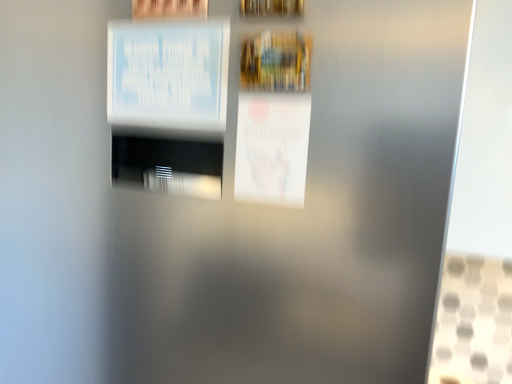
Question: Does white paper poster at center, which appears as the second poster when viewed from the left, touch wooden picture frame at upper center?

Choices:
 (A) no
 (B) yes

Answer: (A)

Question: Does white paper poster at center, marked as the 1th poster in a bottom-to-top arrangement, have a larger size compared to wooden picture frame at upper center?

Choices:
 (A) no
 (B) yes

Answer: (B)

Question: Is the depth of white paper poster at center, which appears as the second poster when viewed from the left, less than that of wooden picture frame at upper center?

Choices:
 (A) no
 (B) yes

Answer: (A)

Question: Can you confirm if white paper poster at center, which appears as the 2th poster when viewed from the top, is taller than wooden picture frame at upper center?

Choices:
 (A) no
 (B) yes

Answer: (B)

Question: Is there a large distance between white paper poster at center, marked as the 1th poster in a bottom-to-top arrangement, and wooden picture frame at upper center?

Choices:
 (A) yes
 (B) no

Answer: (B)

Question: From a real-world perspective, does white paper poster at center, which is counted as the first poster, starting from the right, sit lower than wooden picture frame at upper center?

Choices:
 (A) no
 (B) yes

Answer: (B)

Question: Is white paper at upper left, which is the second poster from right to left, at the back of white paper poster at center, which appears as the 2th poster when viewed from the top?

Choices:
 (A) no
 (B) yes

Answer: (A)

Question: From the image's perspective, does white paper poster at center, which appears as the second poster when viewed from the left, appear higher than white paper at upper left, which is the second poster from right to left?

Choices:
 (A) no
 (B) yes

Answer: (A)

Question: Is white paper poster at center, which is counted as the first poster, starting from the right, positioned behind white paper at upper left, the 1th poster positioned from the left?

Choices:
 (A) no
 (B) yes

Answer: (A)

Question: Considering the relative sizes of white paper poster at center, marked as the 1th poster in a bottom-to-top arrangement, and white paper at upper left, the 1th poster positioned from the left, in the image provided, is white paper poster at center, marked as the 1th poster in a bottom-to-top arrangement, shorter than white paper at upper left, the 1th poster positioned from the left,?

Choices:
 (A) yes
 (B) no

Answer: (A)

Question: Is white paper poster at center, which appears as the second poster when viewed from the left, bigger than white paper at upper left, the first poster from the top?

Choices:
 (A) no
 (B) yes

Answer: (A)

Question: From a real-world perspective, is white paper poster at center, which appears as the second poster when viewed from the left, over white paper at upper left, the 1th poster positioned from the left?

Choices:
 (A) yes
 (B) no

Answer: (B)

Question: Does wooden picture frame at upper center have a greater width compared to white paper poster at center, marked as the 1th poster in a bottom-to-top arrangement?

Choices:
 (A) no
 (B) yes

Answer: (B)